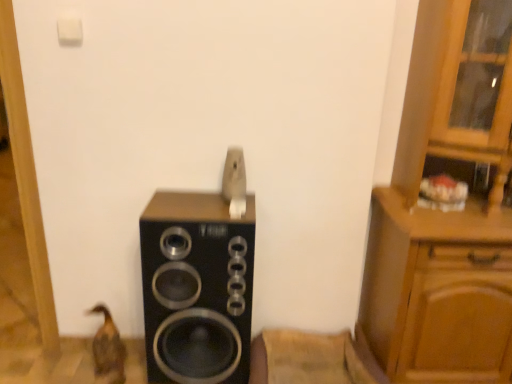
Question: Can you see wooden cabinet at right touching black matte speaker at center?

Choices:
 (A) no
 (B) yes

Answer: (A)

Question: Considering the relative sizes of wooden cabinet at right and black matte speaker at center in the image provided, is wooden cabinet at right bigger than black matte speaker at center?

Choices:
 (A) yes
 (B) no

Answer: (A)

Question: Is wooden cabinet at right in front of black matte speaker at center?

Choices:
 (A) no
 (B) yes

Answer: (B)

Question: Considering the relative positions of wooden cabinet at right and black matte speaker at center in the image provided, is wooden cabinet at right to the right of black matte speaker at center from the viewer's perspective?

Choices:
 (A) yes
 (B) no

Answer: (A)

Question: Is wooden cabinet at right positioned beyond the bounds of black matte speaker at center?

Choices:
 (A) no
 (B) yes

Answer: (B)

Question: Considering the relative sizes of wooden cabinet at right and black matte speaker at center in the image provided, is wooden cabinet at right thinner than black matte speaker at center?

Choices:
 (A) yes
 (B) no

Answer: (B)

Question: Is the position of brown matte duck at lower left more distant than that of black matte speaker at center?

Choices:
 (A) no
 (B) yes

Answer: (B)

Question: Is brown matte duck at lower left positioned with its back to black matte speaker at center?

Choices:
 (A) yes
 (B) no

Answer: (B)

Question: Does brown matte duck at lower left have a lesser height compared to black matte speaker at center?

Choices:
 (A) yes
 (B) no

Answer: (A)

Question: Is brown matte duck at lower left in front of black matte speaker at center?

Choices:
 (A) yes
 (B) no

Answer: (B)

Question: From the image's perspective, is brown matte duck at lower left above black matte speaker at center?

Choices:
 (A) yes
 (B) no

Answer: (B)

Question: From a real-world perspective, does brown matte duck at lower left sit lower than black matte speaker at center?

Choices:
 (A) no
 (B) yes

Answer: (B)

Question: From the image's perspective, is brown matte duck at lower left below wooden cabinet at right?

Choices:
 (A) yes
 (B) no

Answer: (A)